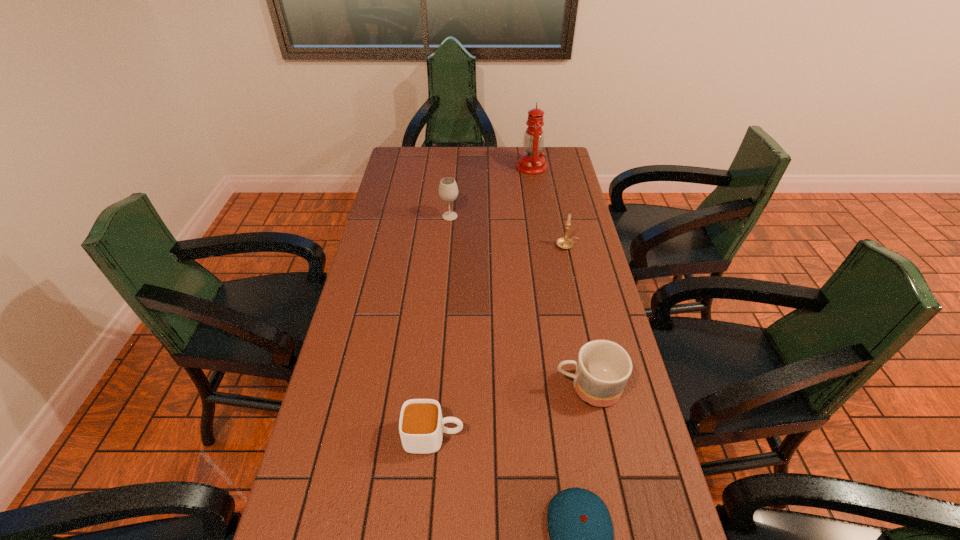
The image size is (960, 540). I want to click on vacant region located on the side with the handle of the fourth tallest object, so click(442, 388).

Find the location of `vacant space situated 0.330m on the side with the handle of the fourth tallest object`. vacant space situated 0.330m on the side with the handle of the fourth tallest object is located at coordinates (426, 388).

Locate an element on the screen. The height and width of the screenshot is (540, 960). vacant region located 0.150m on the side with the handle of the fourth tallest object is located at coordinates point(495,388).

Find the location of a particular element. The image size is (960, 540). free spot located 0.070m on the side with the handle of the fifth farthest object is located at coordinates (493, 437).

I want to click on object present at the far edge, so click(531, 162).

At what (x,y) coordinates should I click in order to perform the action: click on oil lamp located at the right edge. Please return your answer as a coordinate pair (x, y). Looking at the image, I should click on (531, 162).

This screenshot has width=960, height=540. Identify the location of candle holder situated at the right edge. (564, 242).

This screenshot has height=540, width=960. What are the coordinates of `mug present at the right edge` in the screenshot? It's located at (603, 367).

Locate an element on the screen. The height and width of the screenshot is (540, 960). object that is at the far right corner is located at coordinates (531, 162).

Where is `free space at the far edge of the desktop`? free space at the far edge of the desktop is located at coordinates (434, 160).